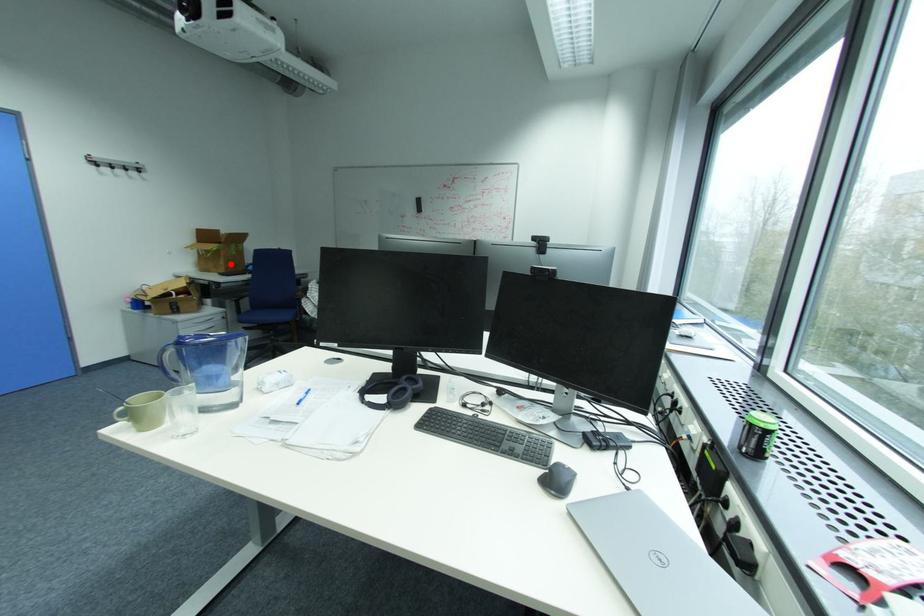
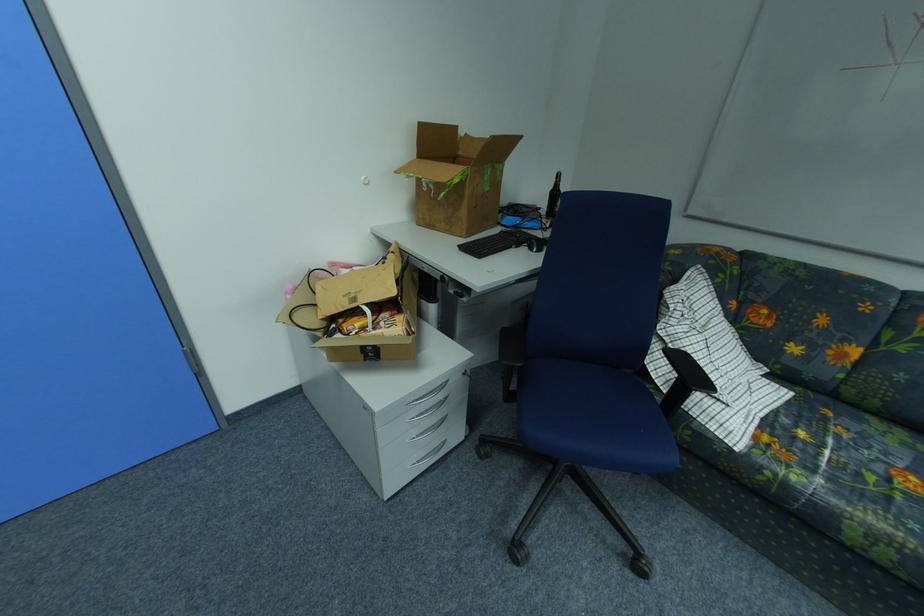
The point at the highlighted location is marked in the first image. Where is the corresponding point in the second image?

(470, 214)